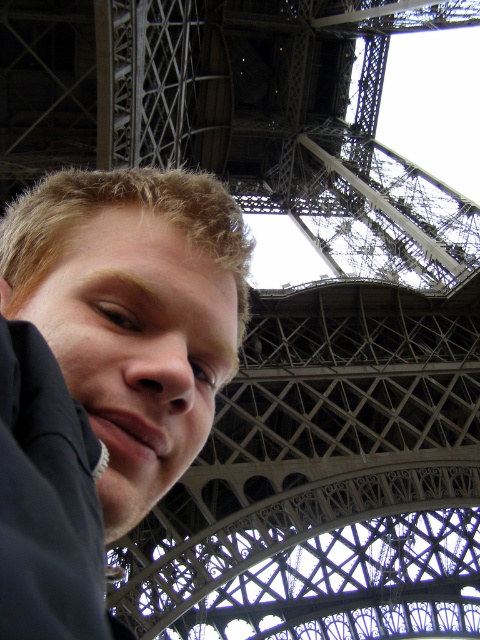
Question: Can you confirm if matte black hair at lower left is positioned to the left of metallic gray lattice structure at center?

Choices:
 (A) yes
 (B) no

Answer: (A)

Question: Which object is farther from the camera taking this photo?

Choices:
 (A) metallic gray lattice structure at center
 (B) matte black hair at lower left

Answer: (A)

Question: In this image, where is matte black hair at lower left located relative to metallic gray lattice structure at center?

Choices:
 (A) right
 (B) left

Answer: (B)

Question: Which object is closer to the camera taking this photo?

Choices:
 (A) metallic gray lattice structure at center
 (B) matte black hair at lower left

Answer: (B)

Question: Can you confirm if matte black hair at lower left is bigger than metallic gray lattice structure at center?

Choices:
 (A) yes
 (B) no

Answer: (B)